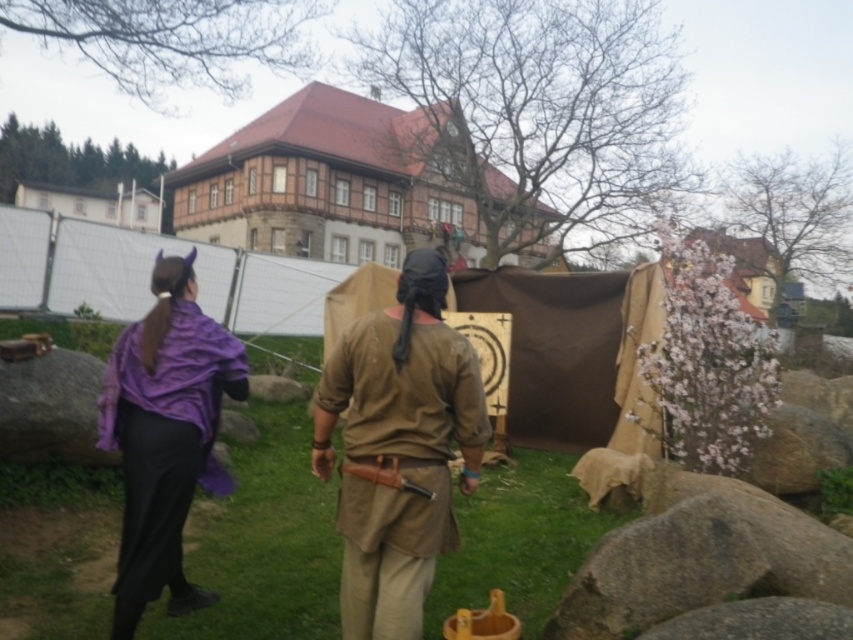
You are a tailor at the medieval fair and need to determine which garment is wider to fit a larger customer. You have the brown leather apron at center and the purple matte robe at left. Which one is wider?

The brown leather apron at center is wider than the purple matte robe at left, so it would be suitable for a larger customer.

You are a visitor at the medieval event and want to take a photo of both the brown leather apron at center and the purple matte robe at left. Which one should you focus on first to ensure it appears in the foreground of your photo?

The brown leather apron at center is in front of the purple matte robe at left, so you should focus on the brown leather apron at center first to ensure it appears in the foreground of your photo.